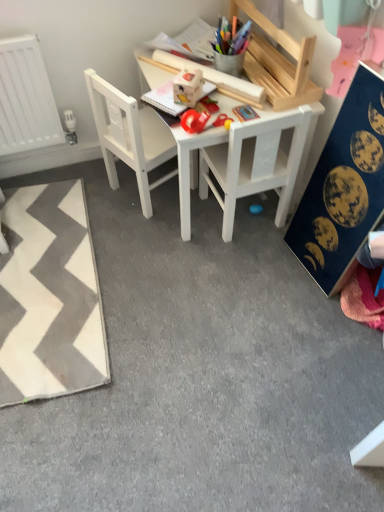
Find the location of a particular element. The height and width of the screenshot is (512, 384). vacant region in front of white matte chair at center, which is the first chair in right-to-left order is located at coordinates (238, 260).